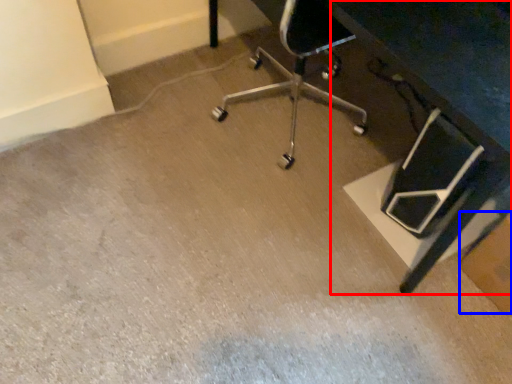
Question: Which of the following is the closest to the observer, table (highlighted by a red box) or cardboard box (highlighted by a blue box)?

Choices:
 (A) table
 (B) cardboard box

Answer: (A)